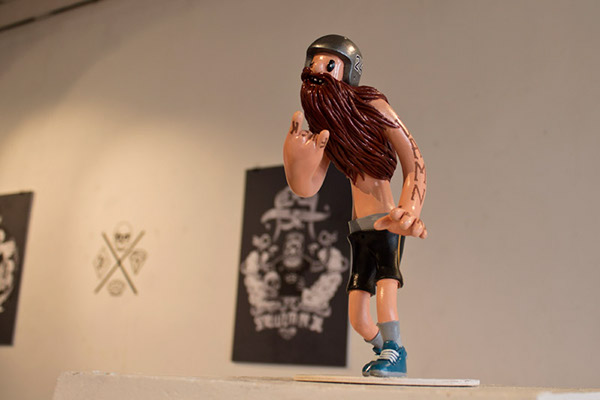
At what (x,y) coordinates should I click in order to perform the action: click on art on the wall. Please return your answer as a coordinate pair (x, y). Looking at the image, I should click on (21, 217), (120, 252), (268, 251).